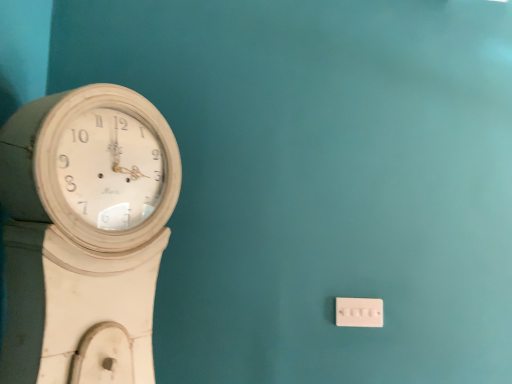
Question: Based on their sizes in the image, would you say white plastic switch at lower right is bigger or smaller than white wooden wall clock at left?

Choices:
 (A) big
 (B) small

Answer: (B)

Question: Relative to white wooden wall clock at left, is white plastic switch at lower right in front or behind?

Choices:
 (A) behind
 (B) front

Answer: (A)

Question: From the image's perspective, is white plastic switch at lower right above or below white wooden wall clock at left?

Choices:
 (A) below
 (B) above

Answer: (A)

Question: From the image's perspective, is white wooden wall clock at left positioned above or below white plastic switch at lower right?

Choices:
 (A) below
 (B) above

Answer: (B)

Question: Considering the positions of white wooden wall clock at left and white plastic switch at lower right in the image, is white wooden wall clock at left taller or shorter than white plastic switch at lower right?

Choices:
 (A) tall
 (B) short

Answer: (A)

Question: Does point (1, 148) appear closer or farther from the camera than point (346, 322)?

Choices:
 (A) farther
 (B) closer

Answer: (B)

Question: From a real-world perspective, is white wooden wall clock at left physically located above or below white plastic switch at lower right?

Choices:
 (A) below
 (B) above

Answer: (B)